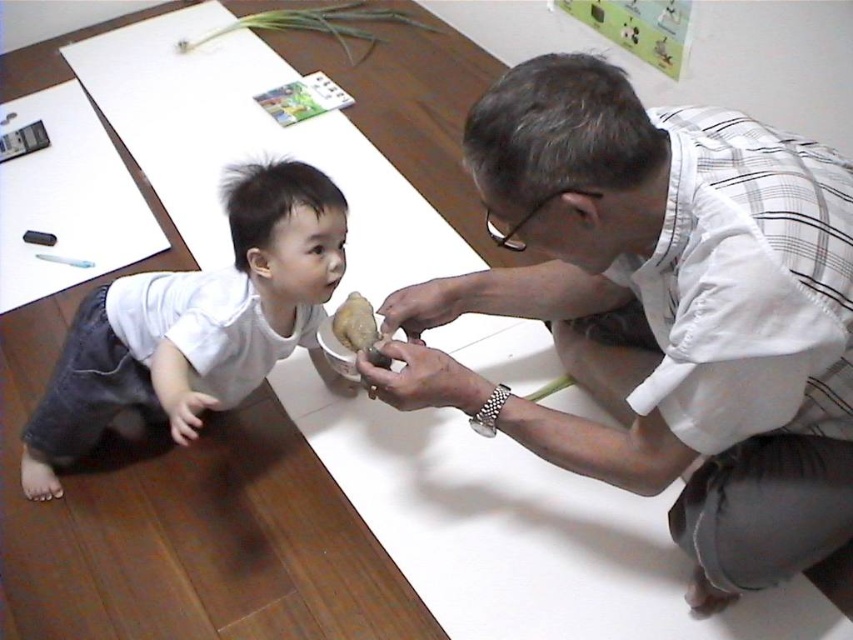
Question: Is white checkered shirt at upper right positioned at the back of slightly translucent white food at center?

Choices:
 (A) no
 (B) yes

Answer: (A)

Question: Which object is closer to the camera taking this photo?

Choices:
 (A) white checkered shirt at upper right
 (B) slightly translucent white food at center

Answer: (A)

Question: Which object is the closest to the white checkered shirt at upper right?

Choices:
 (A) white matte shirt at lower left
 (B) slightly translucent white food at center

Answer: (B)

Question: In this image, where is white checkered shirt at upper right located relative to white matte shirt at lower left?

Choices:
 (A) below
 (B) above

Answer: (B)

Question: Can you confirm if white checkered shirt at upper right is positioned to the left of white matte shirt at lower left?

Choices:
 (A) yes
 (B) no

Answer: (B)

Question: Among these objects, which one is farthest from the camera?

Choices:
 (A) white matte shirt at lower left
 (B) white checkered shirt at upper right

Answer: (A)